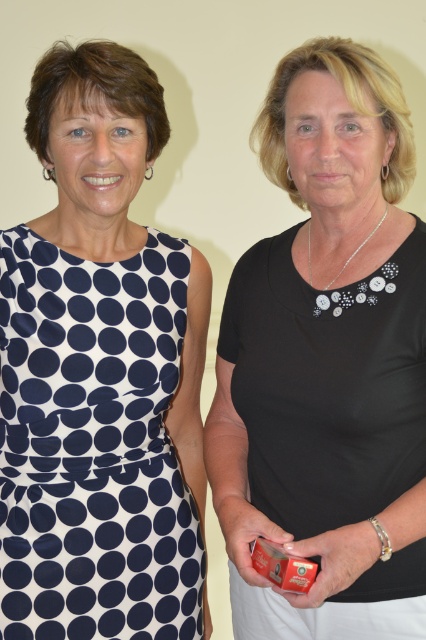
You are a tailor who needs to determine which garment is taller between the black matte shirt at center and the navy blue polka dot fabric dress at left. Based on the image, which one is taller?

The black matte shirt at center has a greater height compared to the navy blue polka dot fabric dress at left, so the black matte shirt at center is taller.

You are a photographer standing 1 meter away from the camera. You need to adjust your position so that you are exactly 1 meter away from the black matte shirt at center. Should you move closer or farther away?

The black matte shirt at center is currently 91.80 centimeters away from the camera. Since you are standing 1 meter away from the camera, you need to move 8.2 centimeters farther away to be exactly 1 meter from the black matte shirt at center.

Consider the image. You are a photographer setting up for a photoshoot. You need to position two models so that they are exactly 10 inches apart. Currently, the black matte shirt at center and the navy blue polka dot fabric dress at left are positioned at 8.48 inches apart. Should you move the models closer or farther apart to meet the requirement?

The current distance between the black matte shirt at center and the navy blue polka dot fabric dress at left is 8.48 inches. To reach the required 10 inches, you should move the models farther apart by approximately 1.52 inches.